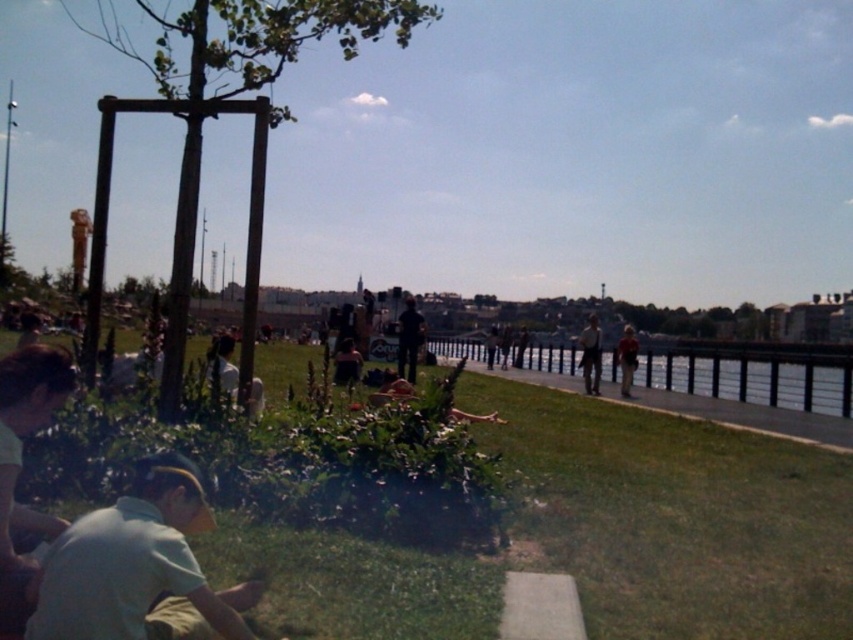
You are standing at the origin point in the riverside scene. You need to locate the light green fabric shirt at lower left. According to the coordinates provided, where exactly is it positioned?

The light green fabric shirt at lower left is located at point 0.883 on the x axis and 0.161 on the y axis.

You are a photographer trying to capture the clear glass waterway at center and the light brown leather jacket at center in the same frame. Which object should you focus on first if you want to ensure both are in focus without adjusting your camera settings?

The clear glass waterway at center has a lesser height compared to light brown leather jacket at center, so you should focus on the light brown leather jacket at center first since it is closer to the camera and has a smaller depth of field requirement.

You are standing at the riverside and want to take a photo of the light green fabric shirt at lower left and the clear glass waterway at center. Which object should you focus on first to ensure both are in sharp focus?

You should focus on the light green fabric shirt at lower left first because it is closer to you than the clear glass waterway at center. By focusing on the closer object, the waterway will likely be in focus as well due to the depth of field.